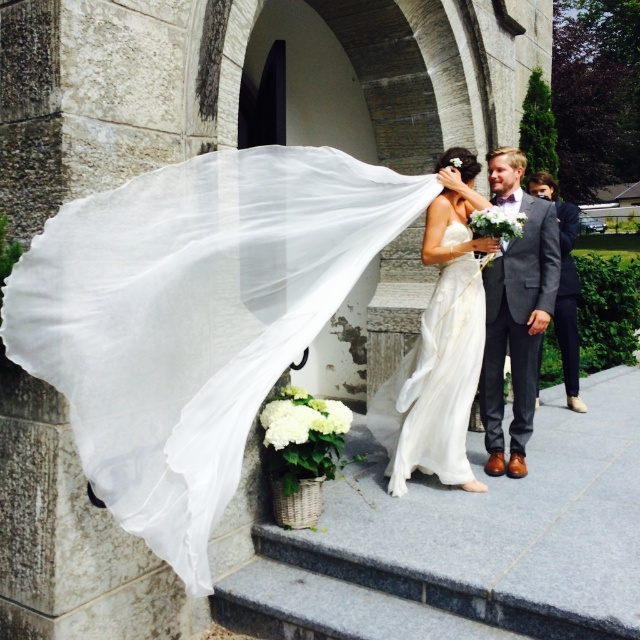
Question: Based on their relative distances, which object is nearer to the matte gray suit at right?

Choices:
 (A) satin white dress at center
 (B) gray wool suit at right

Answer: (B)

Question: Is satin white dress at center above gray wool suit at right?

Choices:
 (A) no
 (B) yes

Answer: (A)

Question: Is satin white dress at center thinner than matte gray suit at right?

Choices:
 (A) no
 (B) yes

Answer: (A)

Question: Is satin white dress at center to the left of gray wool suit at right from the viewer's perspective?

Choices:
 (A) no
 (B) yes

Answer: (B)

Question: Among these objects, which one is nearest to the camera?

Choices:
 (A) satin white dress at center
 (B) gray wool suit at right
 (C) matte gray suit at right

Answer: (A)

Question: Which of these objects is positioned farthest from the gray wool suit at right?

Choices:
 (A) satin white dress at center
 (B) matte gray suit at right

Answer: (B)